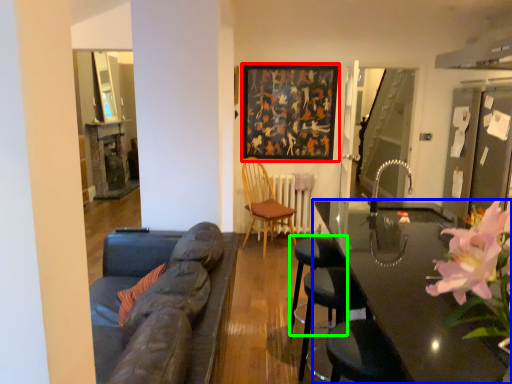
Question: Estimate the real-world distances between objects in this image. Which object is farther from picture frame (highlighted by a red box), table (highlighted by a blue box) or bar stool (highlighted by a green box)?

Choices:
 (A) table
 (B) bar stool

Answer: (B)